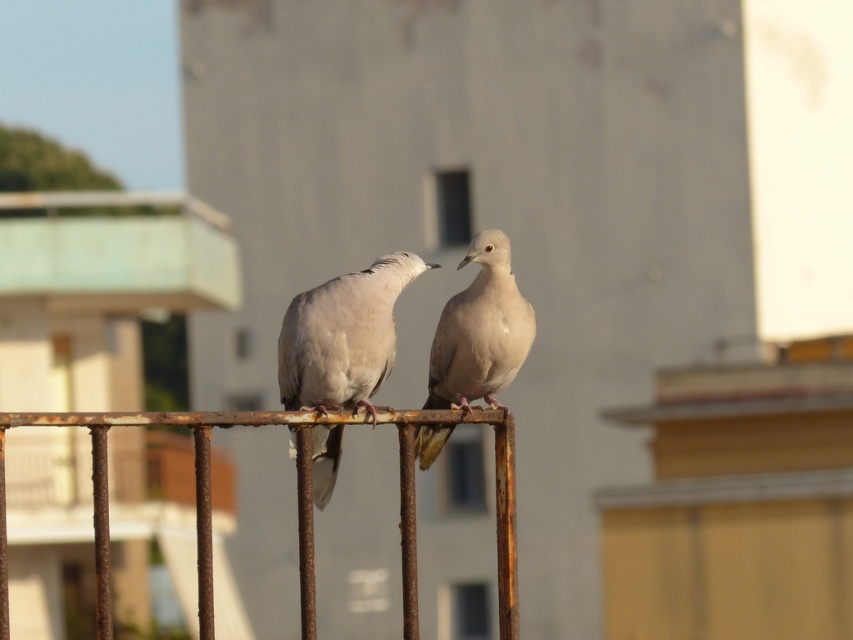
You are a birdwatcher observing two doves. You see the rusty metal fence at center and the matte white dove at center. Which object is located to the right of the other?

The rusty metal fence at center is positioned on the right side of matte white dove at center, so the fence is to the right of the dove.

You are a birdwatcher observing two doves on a fence. The rusty metal fence at center and the light beige feathered dove at center are both in your view. Which object is taller?

The rusty metal fence at center is much taller than the light beige feathered dove at center.

You are standing in the scene and want to take a photo of the two doves perched on the rusty metal railing. The camera you are using has a focal length of 50mm and a sensor size of 24mm x 36mm. If the point at coordinate point (x=410, y=529) is 7.47 meters away from the camera, what is the approximate distance in meters between the two doves?

The distance between the two doves cannot be determined from the given information.